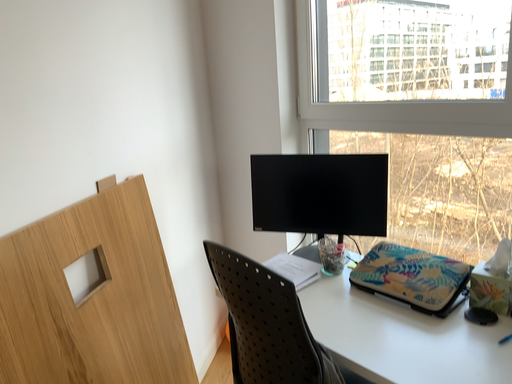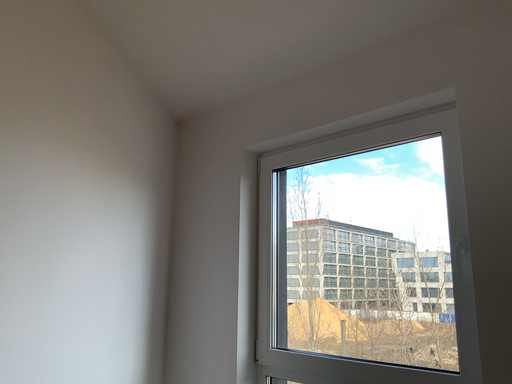
Question: Which way did the camera rotate in the video?

Choices:
 (A) rotated left
 (B) rotated right

Answer: (B)